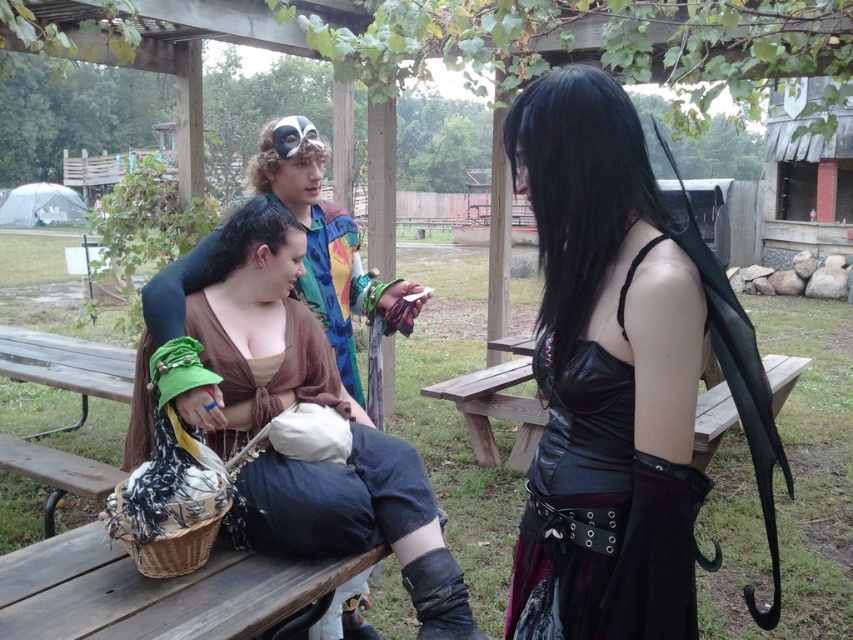
You are a medieval character sitting on the wooden bench at center, and you want to reach the brown fabric top at center to cover yourself from the rain. Can you stretch your arm to grab it without getting up?

The distance between the brown fabric top at center and the wooden bench at center is 2.32 meters. Since the average human arm length is about 0.7 meters, you cannot reach the brown fabric top at center from the wooden bench at center without getting up.

What is located at the coordinates point (224, 339) in the image?

The point (224, 339) marks the location of the green fabric purse at center.